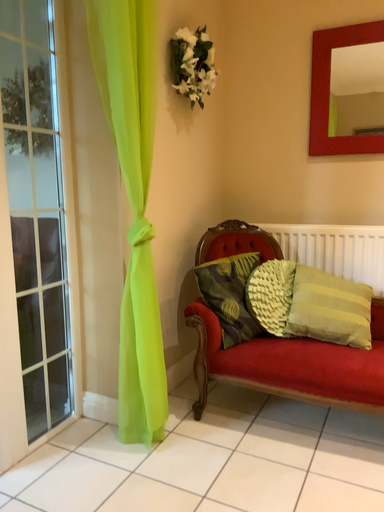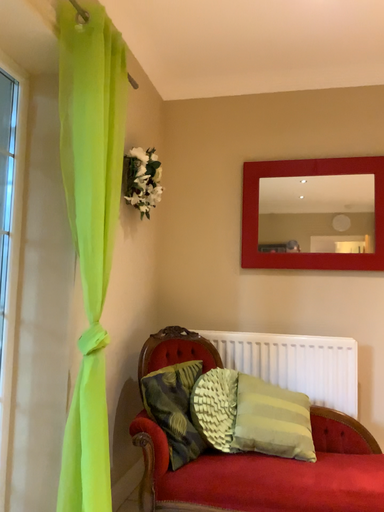
Question: Which way did the camera rotate in the video?

Choices:
 (A) rotated right
 (B) rotated left

Answer: (A)